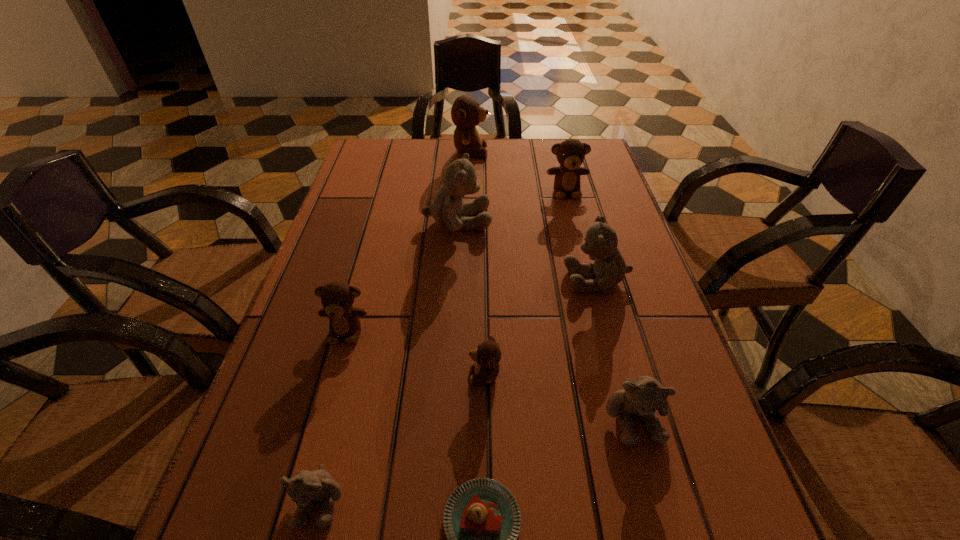
This screenshot has height=540, width=960. What are the coordinates of `free area in between the smallest brown teddy bear and the leftmost brown teddy bear` in the screenshot? It's located at (416, 353).

The height and width of the screenshot is (540, 960). Find the location of `free point between the second farthest object and the nearest brown teddy bear`. free point between the second farthest object and the nearest brown teddy bear is located at coordinates (525, 283).

The height and width of the screenshot is (540, 960). I want to click on vacant area that lies between the farthest teddy bear and the third nearest gray teddy bear, so click(x=534, y=215).

In order to click on vacant space that's between the farthest teddy bear and the second smallest gray teddy bear in this screenshot , I will do `click(552, 285)`.

At what (x,y) coordinates should I click in order to perform the action: click on free space between the second biggest brown teddy bear and the third biggest gray teddy bear. Please return your answer as a coordinate pair (x, y). The image size is (960, 540). Looking at the image, I should click on (600, 304).

Where is `vacant space in between the fourth farthest teddy bear and the rightmost brown teddy bear`? vacant space in between the fourth farthest teddy bear and the rightmost brown teddy bear is located at coordinates (582, 235).

Image resolution: width=960 pixels, height=540 pixels. Find the location of `empty location between the fourth farthest object and the rightmost brown teddy bear`. empty location between the fourth farthest object and the rightmost brown teddy bear is located at coordinates (582, 235).

Locate an element on the screen. vacant area that lies between the third gray teddy bear from right to left and the third biggest brown teddy bear is located at coordinates (401, 276).

The height and width of the screenshot is (540, 960). Identify the location of empty space that is in between the third farthest gray teddy bear and the second farthest teddy bear. (600, 304).

Find the location of `free point between the smallest brown teddy bear and the third nearest brown teddy bear`. free point between the smallest brown teddy bear and the third nearest brown teddy bear is located at coordinates (525, 283).